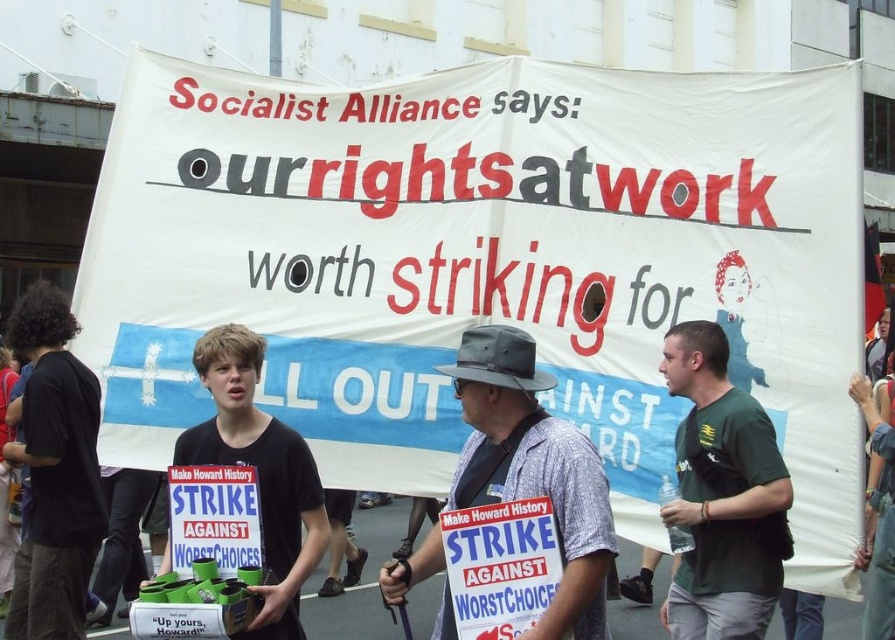
Question: Which point is closer to the camera?

Choices:
 (A) plaid fabric shirt at center
 (B) green fabric shirt at center

Answer: (A)

Question: Which point is closer to the camera?

Choices:
 (A) plaid fabric shirt at center
 (B) black cotton t-shirt at left
 (C) green fabric shirt at center

Answer: (A)

Question: Is green fabric shirt at center further to the viewer compared to black matte t-shirt at center?

Choices:
 (A) no
 (B) yes

Answer: (B)

Question: Is green fabric shirt at center positioned before black matte t-shirt at center?

Choices:
 (A) no
 (B) yes

Answer: (A)

Question: Which object is positioned farthest from the black matte t-shirt at center?

Choices:
 (A) plaid fabric shirt at center
 (B) green fabric shirt at center

Answer: (B)

Question: Does green fabric shirt at center appear on the left side of black matte t-shirt at center?

Choices:
 (A) yes
 (B) no

Answer: (B)